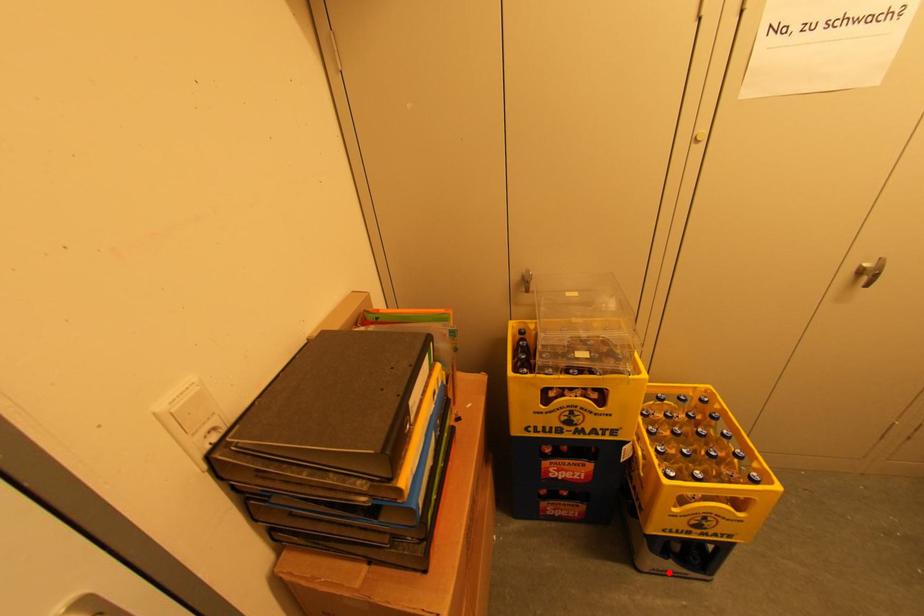
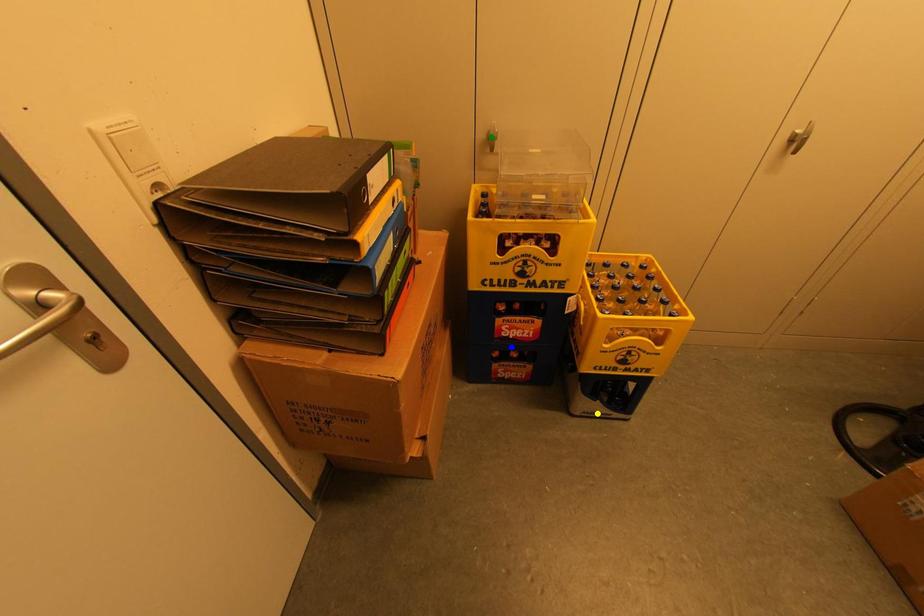
Question: I am providing you with two images of the same scene from different viewpoints. A red point is marked on the first image. You are given multiple points on the second image. In image 2, which mark is for the same physical point as the one in image 1?

Choices:
 (A) yellow point
 (B) blue point
 (C) green point

Answer: (A)